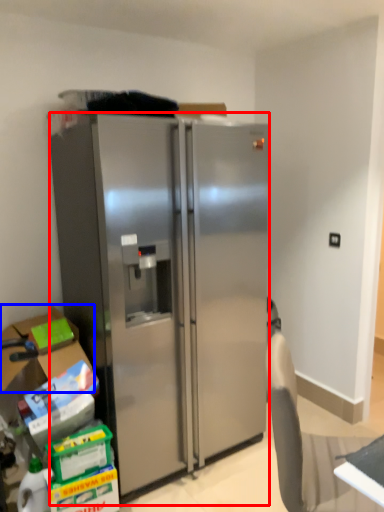
Question: Among these objects, which one is farthest to the camera, refrigerator (highlighted by a red box) or box (highlighted by a blue box)?

Choices:
 (A) refrigerator
 (B) box

Answer: (B)